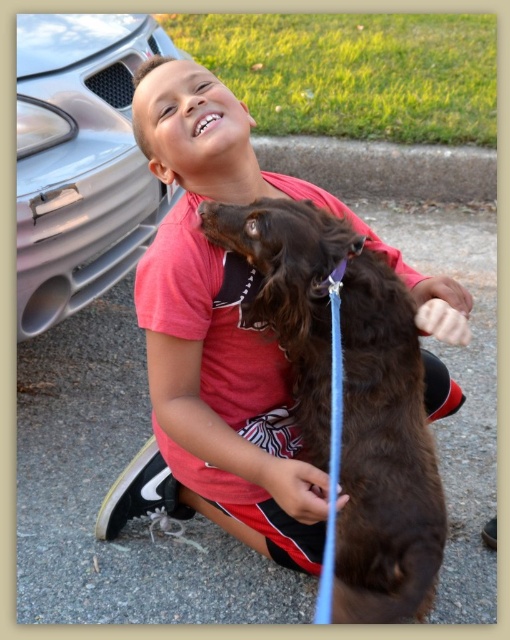
Is matte red shirt at center bigger than brown furry dog at center?

Correct, matte red shirt at center is larger in size than brown furry dog at center.

Does matte red shirt at center have a lesser height compared to brown furry dog at center?

In fact, matte red shirt at center may be taller than brown furry dog at center.

Is point (150, 88) less distant than point (291, 243)?

No, it is not.

I want to click on matte red shirt at center, so click(x=230, y=330).

Who is more distant from viewer, (x=207, y=83) or (x=20, y=104)?

Positioned behind is point (x=20, y=104).

Is point (289, 184) positioned in front of point (98, 81)?

That is True.

At what (x,y) coordinates should I click in order to perform the action: click on matte red shirt at center. Please return your answer as a coordinate pair (x, y). This screenshot has height=640, width=510. Looking at the image, I should click on (230, 330).

At what (x,y) coordinates should I click in order to perform the action: click on matte red shirt at center. Please return your answer as a coordinate pair (x, y). The width and height of the screenshot is (510, 640). Looking at the image, I should click on (230, 330).

What do you see at coordinates (351, 396) in the screenshot? This screenshot has width=510, height=640. I see `brown furry dog at center` at bounding box center [351, 396].

Is point (395, 476) positioned before point (63, 84)?

Yes.

Between point (277, 262) and point (22, 310), which one is positioned in front?

Point (277, 262) is in front.

Where is `brown furry dog at center`? brown furry dog at center is located at coordinates (351, 396).